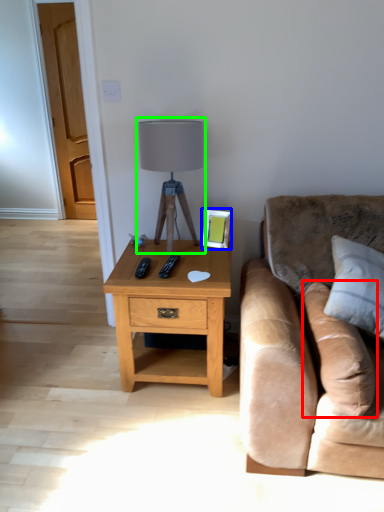
Question: Estimate the real-world distances between objects in this image. Which object is farther from pillow (highlighted by a red box), picture frame (highlighted by a blue box) or table lamp (highlighted by a green box)?

Choices:
 (A) picture frame
 (B) table lamp

Answer: (B)